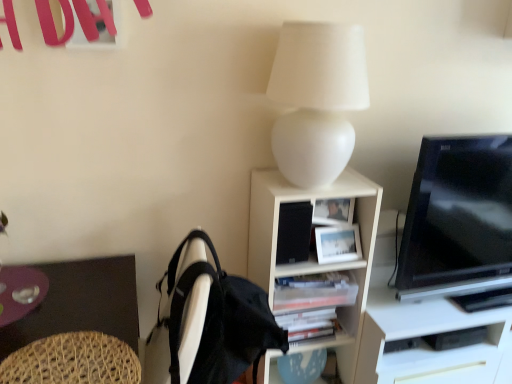
Identify the location of free spot above woven wood swivel chair at lower left (from a real-world perspective). (68, 358).